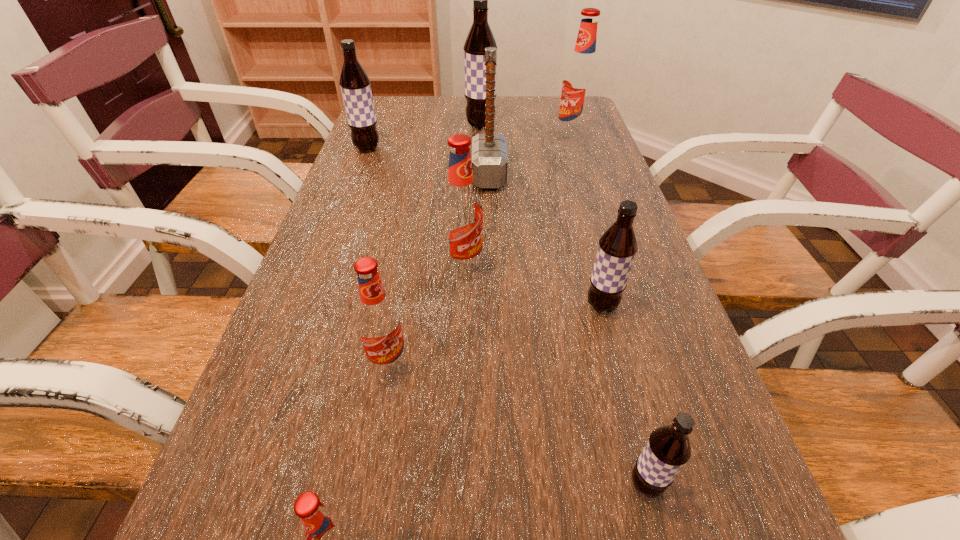
Where is `free location located 0.270m on the striking surface of the brown hammer`? free location located 0.270m on the striking surface of the brown hammer is located at coordinates (374, 176).

Find the location of a particular element. vacant position located 0.150m on the back of the leftmost root beer is located at coordinates (378, 120).

Locate an element on the screen. The height and width of the screenshot is (540, 960). vacant area located 0.320m on the right of the fifth farthest object is located at coordinates (632, 267).

Find the location of `free space located on the right of the third farthest red root beer`. free space located on the right of the third farthest red root beer is located at coordinates (488, 365).

Locate an element on the screen. free space located 0.160m on the back of the third biggest brown root beer is located at coordinates (585, 243).

Image resolution: width=960 pixels, height=540 pixels. Identify the location of vacant space situated 0.080m on the right of the second nearest object. (720, 484).

Where is `object at the far edge`? Image resolution: width=960 pixels, height=540 pixels. object at the far edge is located at coordinates (480, 36).

Where is `object present at the left edge`? The width and height of the screenshot is (960, 540). object present at the left edge is located at coordinates (355, 85).

The width and height of the screenshot is (960, 540). Find the location of `vacant space at the far edge`. vacant space at the far edge is located at coordinates (450, 98).

Locate an element on the screen. The width and height of the screenshot is (960, 540). vacant space at the left edge of the desktop is located at coordinates (338, 282).